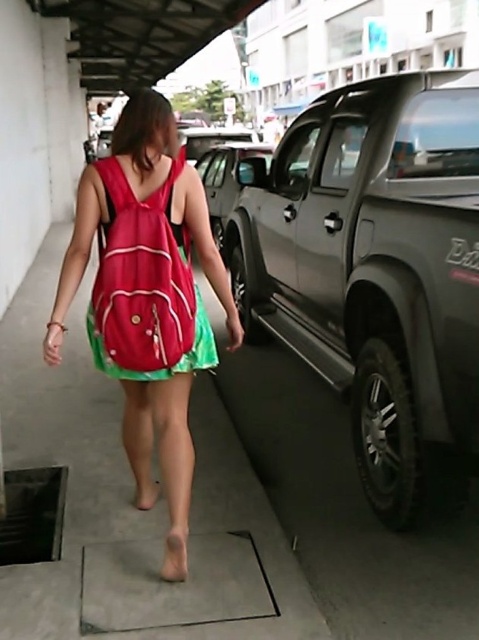
You are a photographer trying to capture the green satin dress at center and the green fabric pavement at center in a single shot. Which object will appear larger in the photo?

The green fabric pavement at center will appear larger in the photo because it is closer to the viewer than the green satin dress at center.

You are a photographer trying to capture the green satin dress at center and the green fabric pavement at center in the same frame. Based on the scene described, which object is positioned higher in the image?

The green fabric pavement at center is taller than the green satin dress at center, so the green fabric pavement at center is positioned higher in the image.